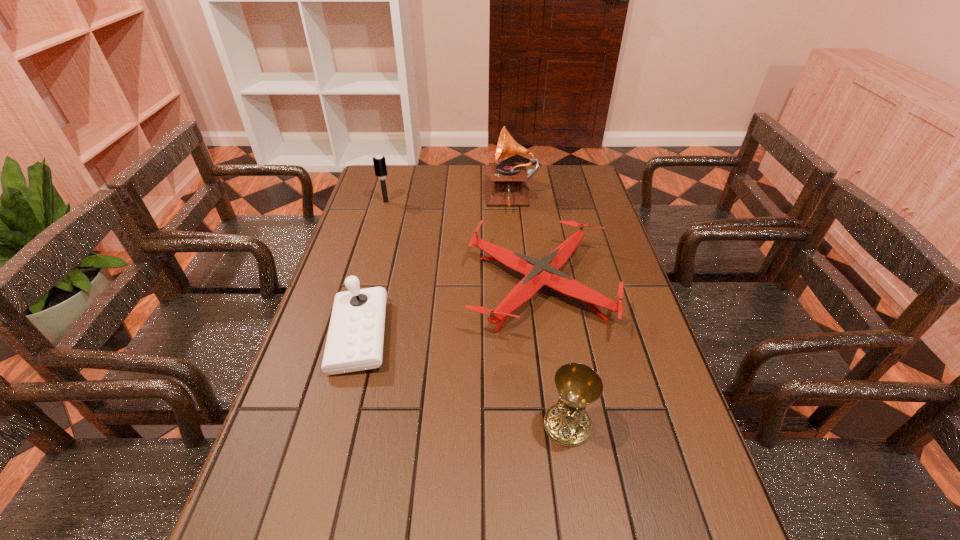
Select which object is the fourth closest to the tallest object. Please provide its 2D coordinates. Your answer should be formatted as a tuple, i.e. [(x, y)], where the tuple contains the x and y coordinates of a point satisfying the conditions above.

[(567, 423)]

Locate an element on the screen. This screenshot has height=540, width=960. vacant position in the image that satisfies the following two spatial constraints: 1. on the horn of the phonograph record; 2. on the front side of the hairbrush is located at coordinates (512, 202).

In order to click on vacant space that satisfies the following two spatial constraints: 1. on the horn of the phonograph record; 2. on the back side of the second shortest object in this screenshot , I will do `click(520, 287)`.

Identify the location of free space that satisfies the following two spatial constraints: 1. on the front side of the hairbrush; 2. on the left side of the chalice. Image resolution: width=960 pixels, height=540 pixels. (321, 425).

Where is `vacant space that satisfies the following two spatial constraints: 1. on the horn of the tallest object; 2. on the front side of the third shortest object`? This screenshot has width=960, height=540. vacant space that satisfies the following two spatial constraints: 1. on the horn of the tallest object; 2. on the front side of the third shortest object is located at coordinates (525, 336).